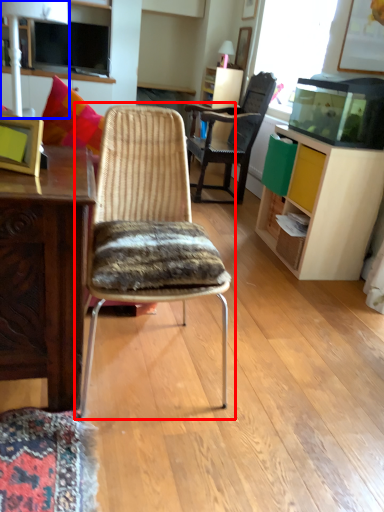
Question: Which object appears closest to the camera in this image, chair (highlighted by a red box) or lamp (highlighted by a blue box)?

Choices:
 (A) chair
 (B) lamp

Answer: (A)